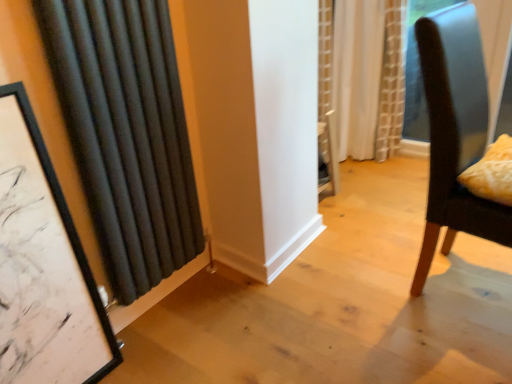
Image resolution: width=512 pixels, height=384 pixels. In order to click on vacant space in dark brown leather chair at right (from a real-world perspective) in this screenshot , I will do `click(468, 278)`.